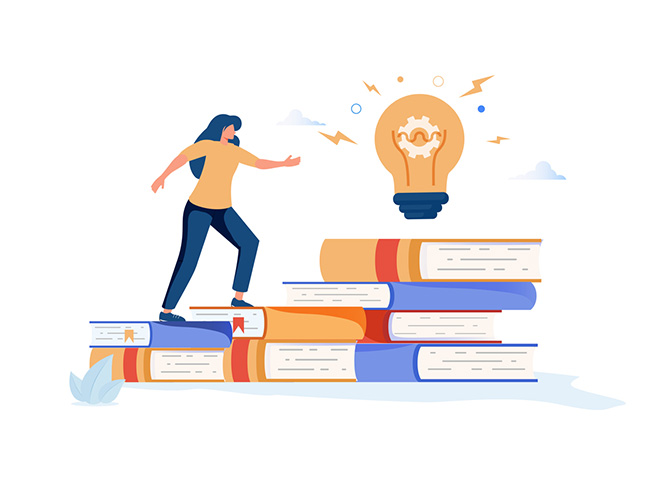
This screenshot has height=487, width=650. In order to click on book in this screenshot , I will do `click(157, 362)`, `click(175, 332)`, `click(305, 357)`, `click(309, 318)`, `click(400, 355)`, `click(420, 316)`, `click(351, 294)`, `click(469, 266)`.